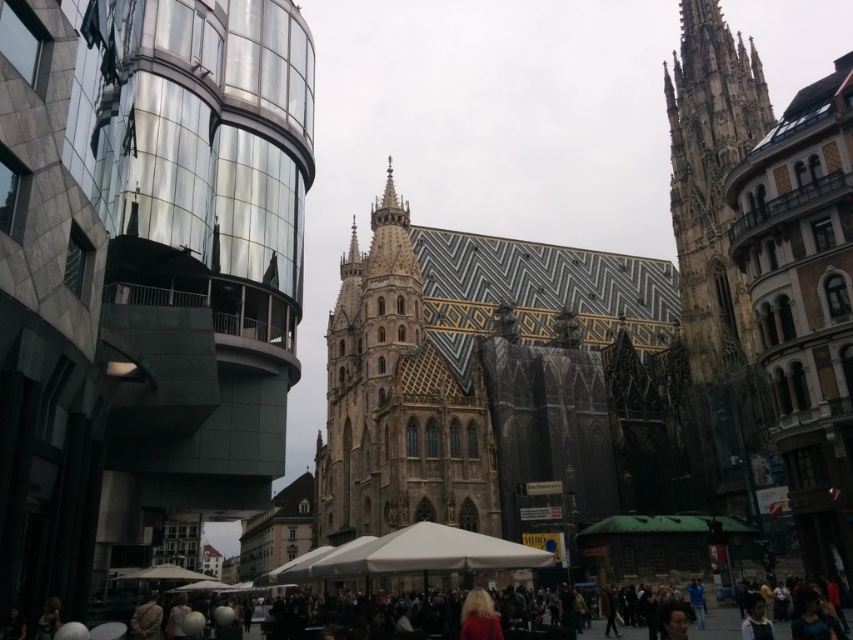
Question: Based on their relative distances, which object is nearer to the dark brown leather jacket at lower center?

Choices:
 (A) brown stone tower at right
 (B) golden mosaic tiles at center

Answer: (B)

Question: Can you confirm if golden mosaic tiles at center is positioned to the right of dark brown leather jacket at lower center?

Choices:
 (A) yes
 (B) no

Answer: (A)

Question: Considering the relative positions of golden mosaic tiles at center and dark brown leather jacket at lower center in the image provided, where is golden mosaic tiles at center located with respect to dark brown leather jacket at lower center?

Choices:
 (A) below
 (B) above

Answer: (B)

Question: Which of the following is the farthest from the observer?

Choices:
 (A) (703, 380)
 (B) (503, 620)

Answer: (A)

Question: Among these points, which one is farthest from the camera?

Choices:
 (A) (346, 634)
 (B) (753, 84)
 (C) (502, 454)
 (D) (231, 225)

Answer: (B)

Question: Observing the image, what is the correct spatial positioning of golden mosaic church at center in reference to dark brown leather jacket at lower center?

Choices:
 (A) left
 (B) right

Answer: (A)